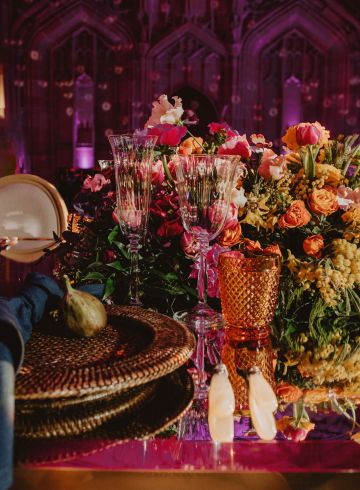
The image size is (360, 490). I want to click on champagne flute, so click(130, 196).